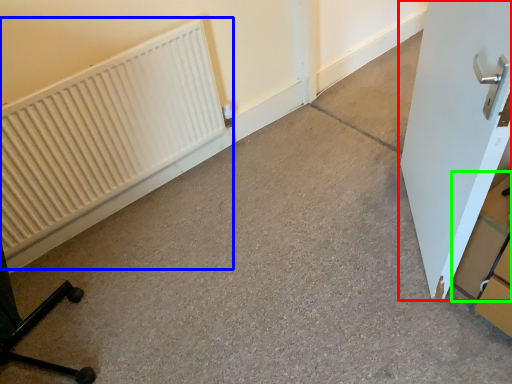
Question: Which object is the closest to the door (highlighted by a red box)? Choose among these: radiator (highlighted by a blue box) or cardboard box (highlighted by a green box).

Choices:
 (A) radiator
 (B) cardboard box

Answer: (B)